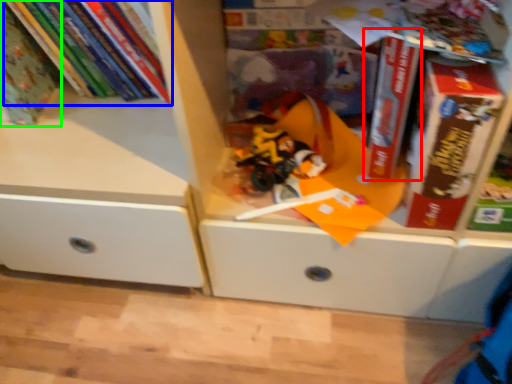
Question: Considering the real-world distances, which object is farthest from paperback book (highlighted by a red box)? book (highlighted by a blue box) or book (highlighted by a green box)?

Choices:
 (A) book
 (B) book

Answer: (B)